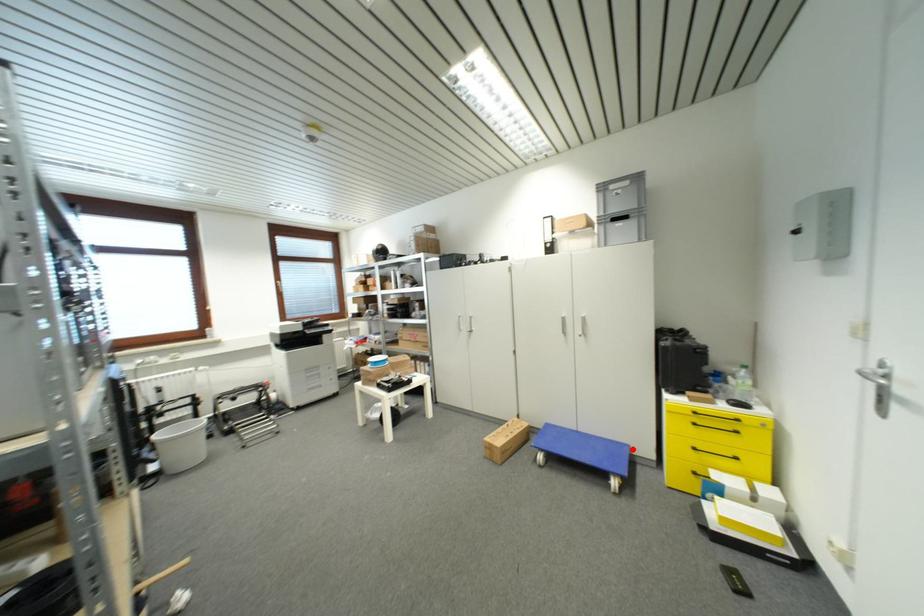
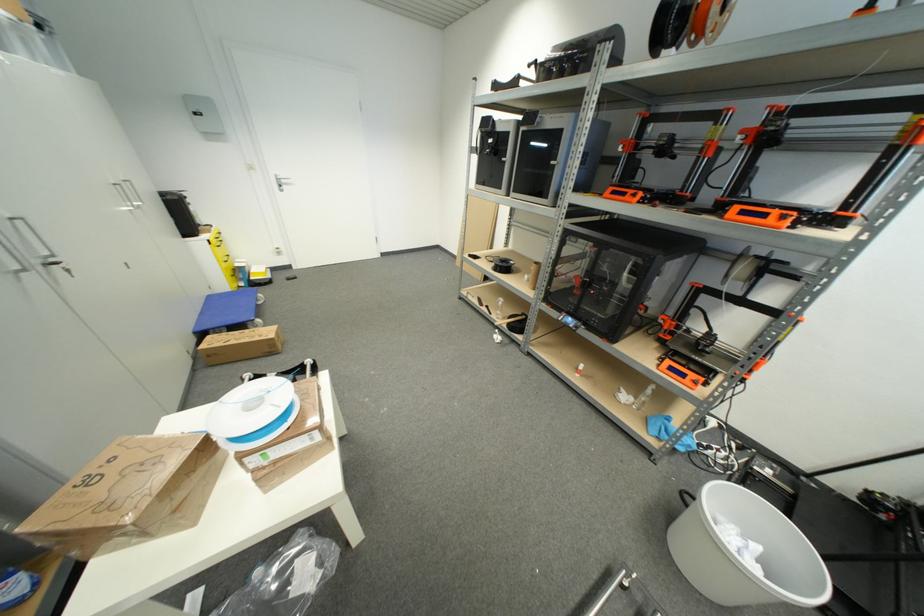
Where in the second image is the point corresponding to the highlighted location from the first image?

(213, 299)